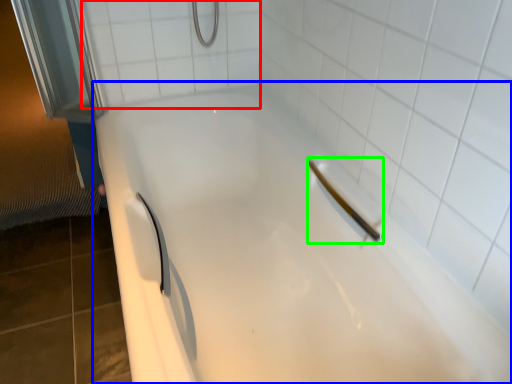
Question: Based on their relative distances, which object is farther from ceramic tile (highlighted by a red box)? Choose from bathtub (highlighted by a blue box) and shower (highlighted by a green box).

Choices:
 (A) bathtub
 (B) shower

Answer: (B)